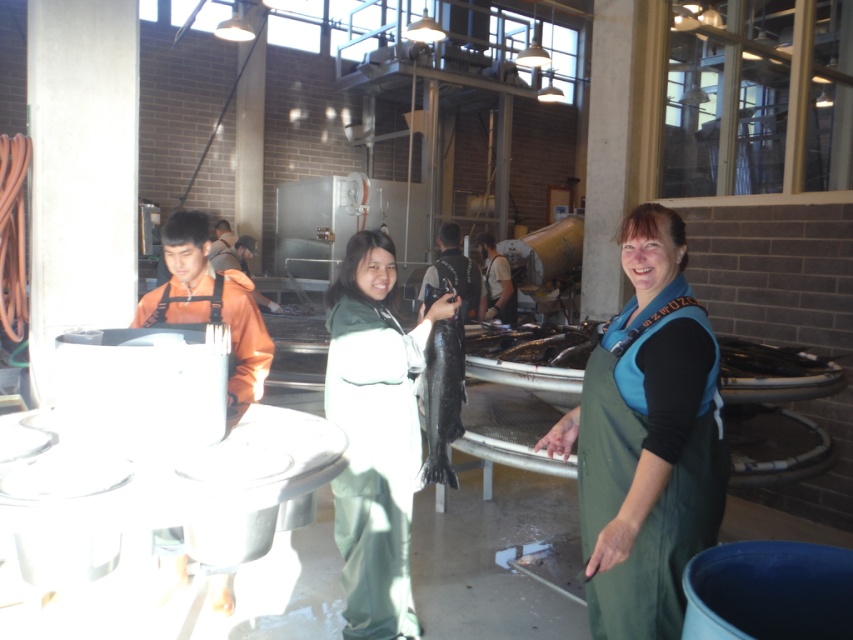
Question: Does green fabric apron at center appear under green matte uniform at center?

Choices:
 (A) no
 (B) yes

Answer: (A)

Question: Is green fabric apron at center positioned before shiny black fish at center?

Choices:
 (A) yes
 (B) no

Answer: (A)

Question: Which of the following is the closest to the observer?

Choices:
 (A) green fabric apron at center
 (B) black matte fish at center

Answer: (A)

Question: Does green matte uniform at center have a larger size compared to black matte fish at center?

Choices:
 (A) no
 (B) yes

Answer: (B)

Question: Based on their relative distances, which object is farther from the green matte uniform at center?

Choices:
 (A) black matte fish at center
 (B) shiny black fish at center

Answer: (B)

Question: Which of these objects is positioned farthest from the green fabric apron at center?

Choices:
 (A) shiny black fish at center
 (B) black matte fish at center

Answer: (B)